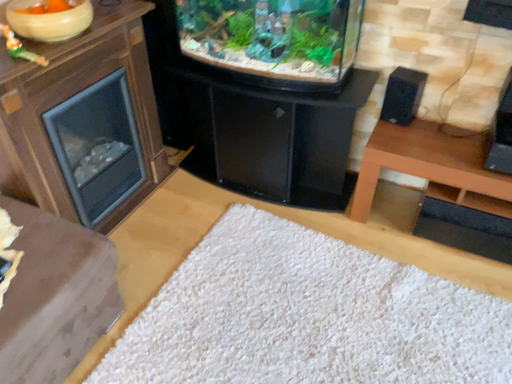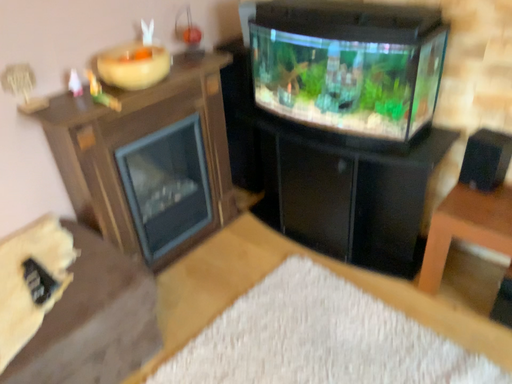
Question: Which way did the camera rotate in the video?

Choices:
 (A) rotated downward
 (B) rotated upward

Answer: (B)